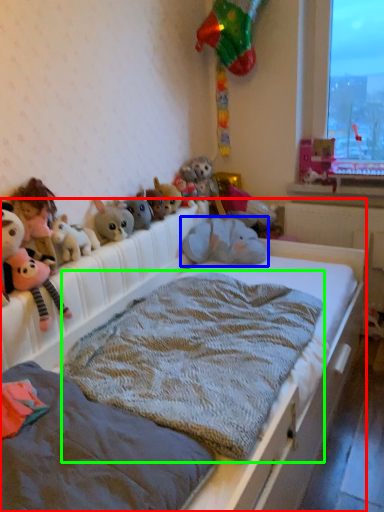
Question: Which object is the farthest from bed (highlighted by a red box)? Choose among these: toy (highlighted by a blue box) or blanket (highlighted by a green box).

Choices:
 (A) toy
 (B) blanket

Answer: (A)